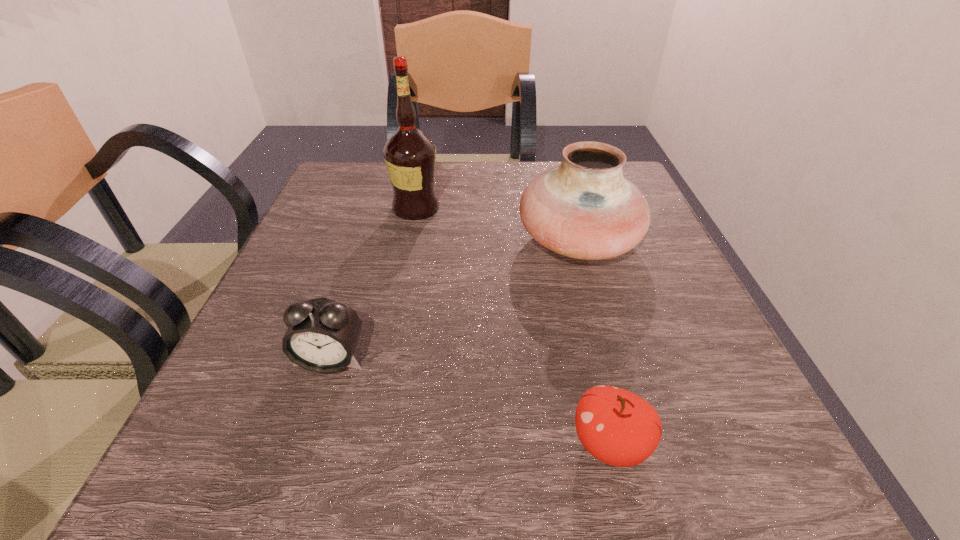
What are the coordinates of `object located at the near edge` in the screenshot? It's located at click(616, 426).

This screenshot has width=960, height=540. What are the coordinates of `object at the left edge` in the screenshot? It's located at (322, 334).

Locate an element on the screen. pottery at the right edge is located at coordinates (585, 209).

You are a GUI agent. You are given a task and a screenshot of the screen. Output one action in this format:
    pyautogui.click(x=<x>, y=<y>)
    Task: Click on the apple at the right edge
    
    Given the screenshot: What is the action you would take?
    pyautogui.click(x=616, y=426)

Where is `object located in the far right corner section of the desktop`? object located in the far right corner section of the desktop is located at coordinates (585, 209).

I want to click on object located in the near right corner section of the desktop, so click(x=616, y=426).

This screenshot has height=540, width=960. I want to click on vacant space at the far edge of the desktop, so click(486, 201).

This screenshot has height=540, width=960. I want to click on vacant area at the near edge, so click(478, 456).

Find the location of a particular element. vacant space at the left edge of the desktop is located at coordinates (350, 285).

Find the location of a particular element. This screenshot has height=540, width=960. vacant region at the right edge of the desktop is located at coordinates [x=659, y=249].